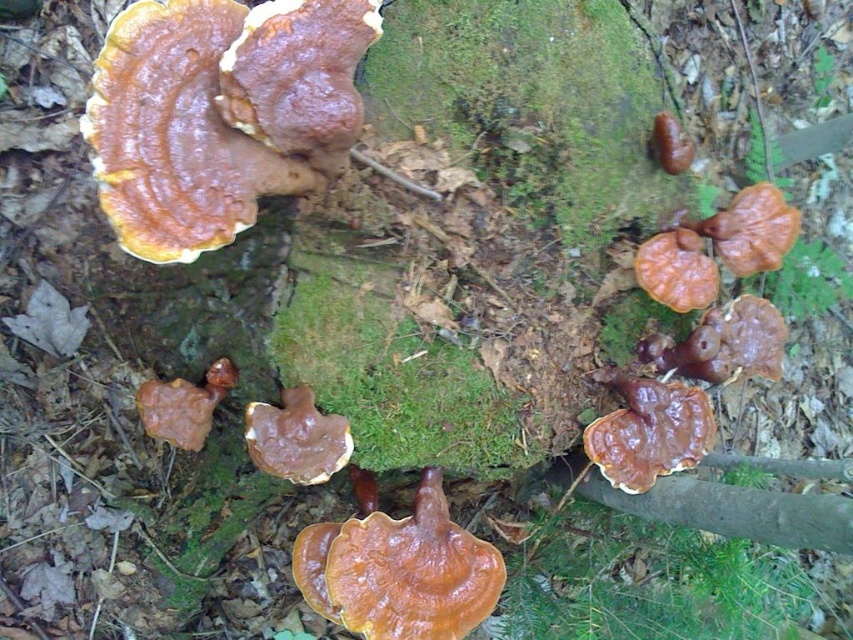
Which is more to the right, glossy orange fungus at lower right or shiny orange bracket fungus at right?

shiny orange bracket fungus at right

Is point (697, 388) positioned after point (715, 285)?

That is True.

The height and width of the screenshot is (640, 853). In order to click on glossy orange fungus at lower right in this screenshot , I will do `click(648, 433)`.

Based on the photo, can you confirm if glossy orange fungus at lower right is smaller than brown leathery fungus at center?

No.

Can you confirm if glossy orange fungus at lower right is wider than brown leathery fungus at center?

Correct, the width of glossy orange fungus at lower right exceeds that of brown leathery fungus at center.

Who is more distant from viewer, (598, 440) or (167, 436)?

Point (598, 440)

The image size is (853, 640). What are the coordinates of `glossy orange fungus at lower right` in the screenshot? It's located at (648, 433).

Does brown matte mushroom at upper left have a lesser width compared to brown matte mushroom at center?

No.

This screenshot has height=640, width=853. I want to click on brown matte mushroom at upper left, so click(x=219, y=113).

Identify the location of brown matte mushroom at upper left. (219, 113).